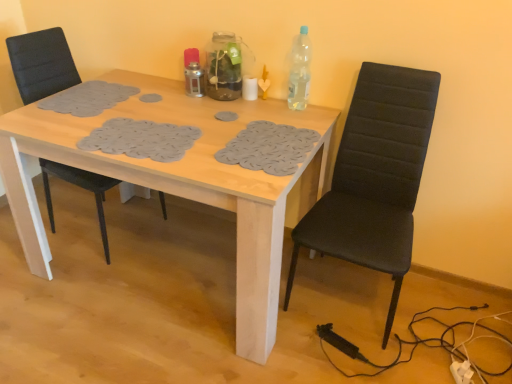
Identify the location of free space between light wood table at center and black fabric chair at right, the first chair from the right. (312, 353).